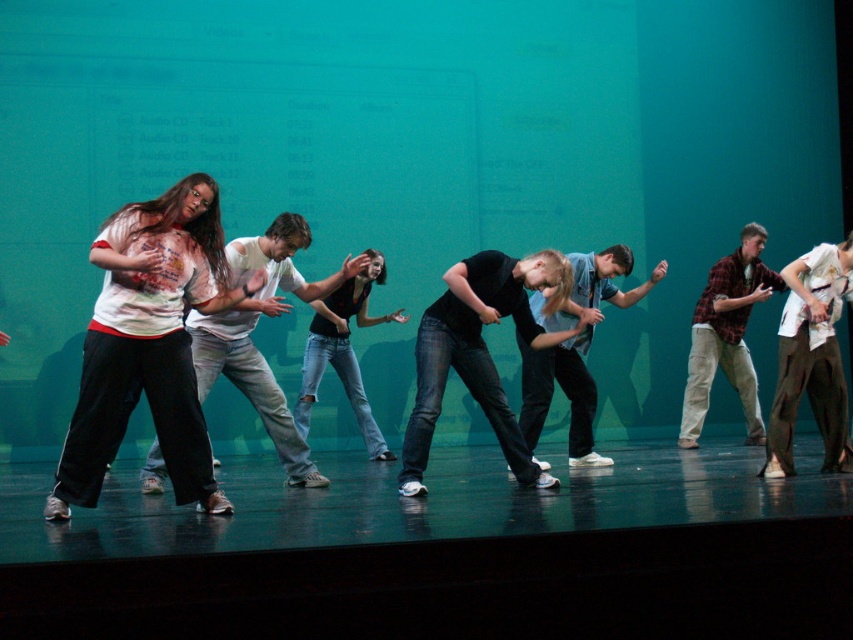
The height and width of the screenshot is (640, 853). Describe the element at coordinates (149, 342) in the screenshot. I see `matte white shirt at left` at that location.

Which is more to the right, matte white shirt at left or white cotton shirt at center?

From the viewer's perspective, white cotton shirt at center appears more on the right side.

You are a GUI agent. You are given a task and a screenshot of the screen. Output one action in this format:
    pyautogui.click(x=<x>, y=<y>)
    Task: Click on the matte white shirt at left
    The width and height of the screenshot is (853, 640).
    Given the screenshot: What is the action you would take?
    pyautogui.click(x=149, y=342)

Between white cotton shirt at center and light blue shirt at center, which one appears on the left side from the viewer's perspective?

Positioned to the left is white cotton shirt at center.

Which is in front, point (202, 365) or point (590, 284)?

Point (202, 365) is more forward.

This screenshot has height=640, width=853. Find the location of `white cotton shirt at center`. white cotton shirt at center is located at coordinates (252, 330).

Is light blue shirt at center to the left of plaid flannel shirt at center from the viewer's perspective?

Correct, you'll find light blue shirt at center to the left of plaid flannel shirt at center.

This screenshot has width=853, height=640. In order to click on light blue shirt at center in this screenshot , I will do `click(575, 348)`.

Identify the location of light blue shirt at center. The height and width of the screenshot is (640, 853). (575, 348).